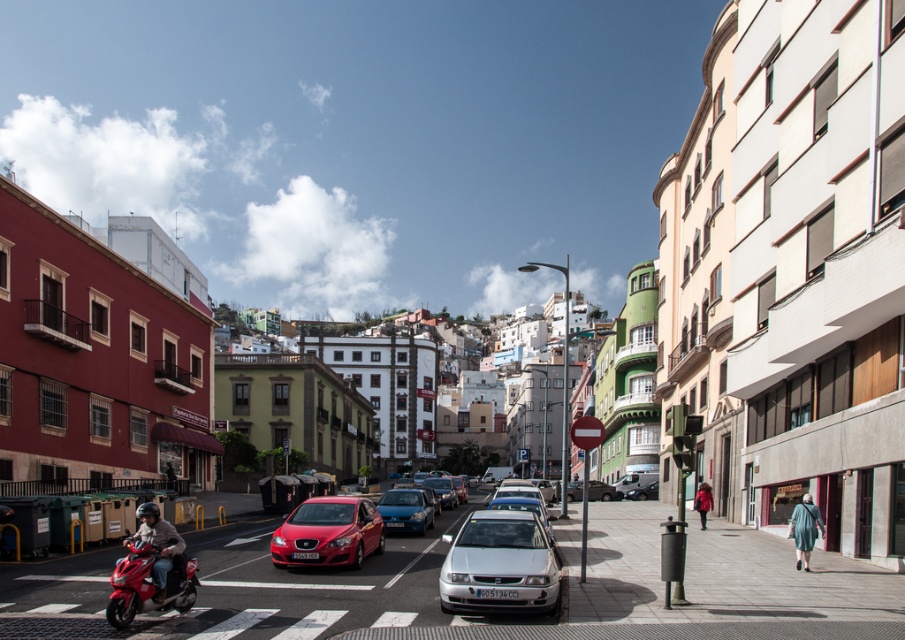
You are standing at the camera position and want to take a photo of the blue metallic hatchback at center. Considering the distance, would you need to use a zoom lens to capture the entire vehicle in the frame?

The blue metallic hatchback at center is 33.82 meters away from the camera. Depending on the lens focal length and sensor size, a zoom lens might be necessary to frame the vehicle properly at that distance.

You are a delivery person who needs to load a large package onto a vehicle. You see the shiny red scooter at lower left and the shiny red sedan at center. Which vehicle can accommodate the package in terms of height?

The shiny red scooter at lower left has a greater height compared to the shiny red sedan at center, so the package can be placed on the shiny red scooter at lower left if it requires more vertical space.